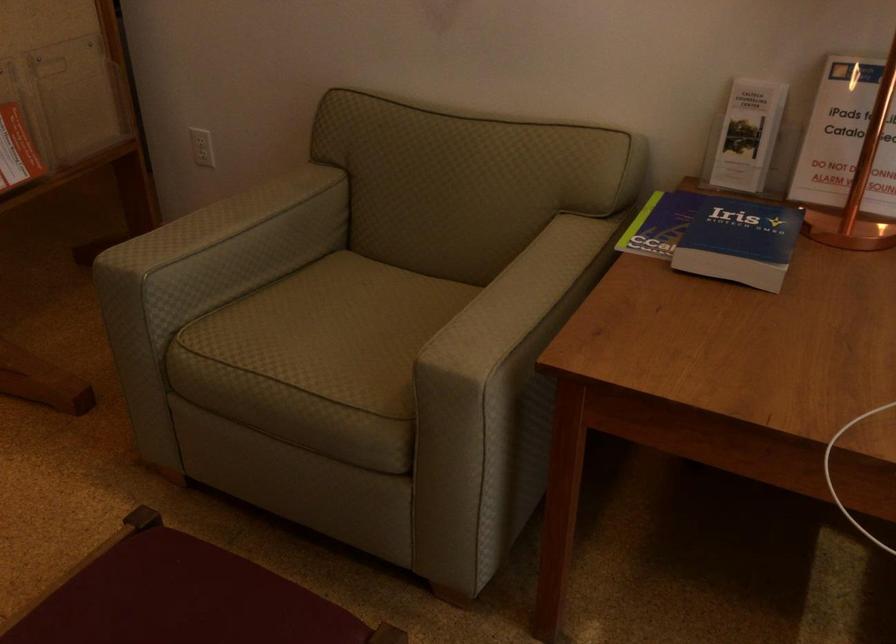
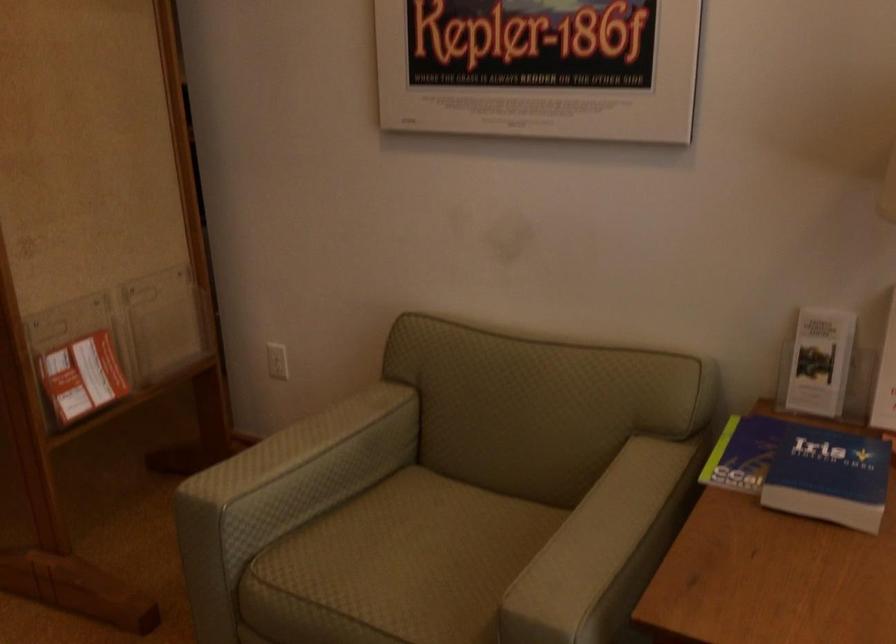
Find the pixel in the second image that matches [333,328] in the first image.

(407, 563)